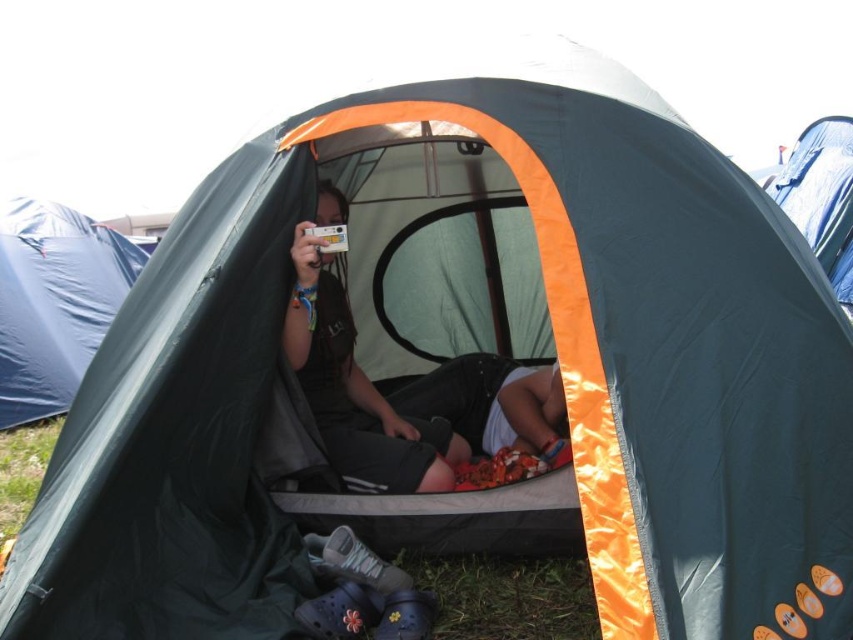
Which is behind, point (300, 307) or point (805, 221)?

The point (805, 221) is behind.

This screenshot has width=853, height=640. I want to click on matte black shorts at center, so click(404, 387).

Is point (463, 400) in front of point (71, 260)?

That is True.

Can you confirm if matte black shorts at center is positioned to the left of blue tarpaulin tent at left?

Incorrect, matte black shorts at center is not on the left side of blue tarpaulin tent at left.

The image size is (853, 640). What are the coordinates of `matte black shorts at center` in the screenshot? It's located at pyautogui.click(x=404, y=387).

Who is positioned more to the right, blue tarpaulin tent at left or blue tarpaulin tent at upper right?

From the viewer's perspective, blue tarpaulin tent at upper right appears more on the right side.

Is blue tarpaulin tent at left smaller than blue tarpaulin tent at upper right?

Yes.

Which is in front, point (45, 269) or point (772, 193)?

Point (45, 269) is in front.

Identify the location of blue tarpaulin tent at left. (54, 301).